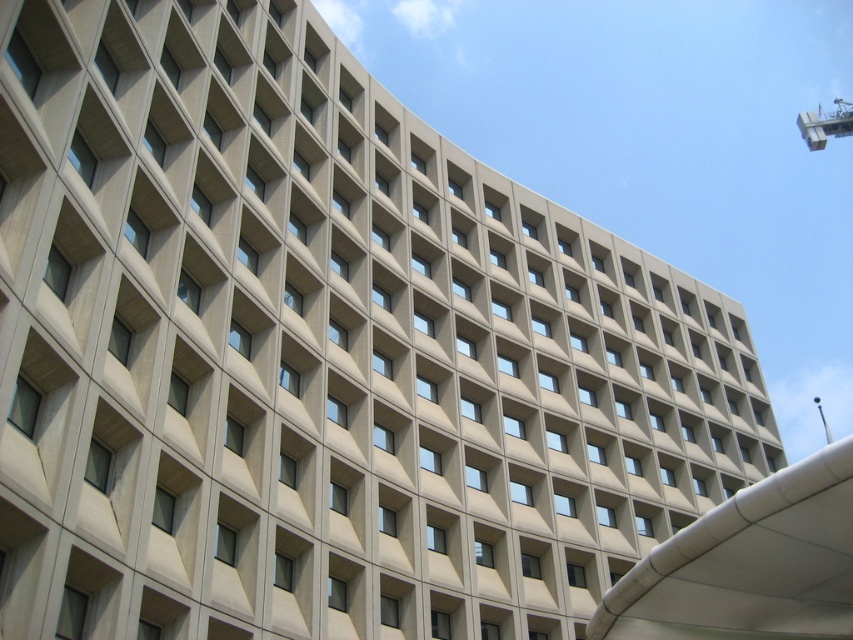
Question: Which object is farther from the camera taking this photo?

Choices:
 (A) metallic crane at upper right
 (B) white matte lift at lower right

Answer: (A)

Question: Can you confirm if white matte lift at lower right is smaller than metallic crane at upper right?

Choices:
 (A) yes
 (B) no

Answer: (A)

Question: Does white matte lift at lower right have a greater width compared to metallic crane at upper right?

Choices:
 (A) yes
 (B) no

Answer: (B)

Question: Can you confirm if white matte lift at lower right is wider than metallic crane at upper right?

Choices:
 (A) yes
 (B) no

Answer: (B)

Question: Which point is closer to the camera?

Choices:
 (A) (817, 112)
 (B) (766, 544)

Answer: (B)